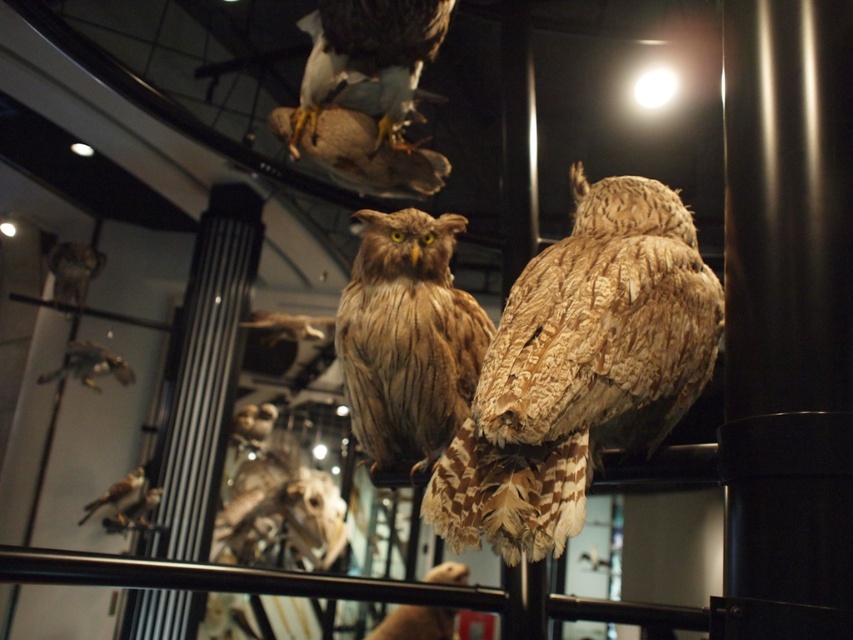
You are a museum visitor looking at the display of taxidermied birds. You see the brown feathered owl at upper center and the brown speckled feathers at lower left. Which object is positioned higher in the display?

The brown feathered owl at upper center is positioned higher than the brown speckled feathers at lower left.

You are a museum curator checking the display. You need to determine if the brown textured owl at center can be placed on a shelf that can only hold items up to the size of the brown feathered owl at upper center. Can it fit?

The brown textured owl at center is smaller than the brown feathered owl at upper center, so it can fit on the shelf designed for the latter.

You are a museum visitor observing the mounted birds. You notice two items at the center of the display. One is labeled as brown textured feathers at center and the other as brown textured owl at center. Which of these two items is located to the right of the other?

The brown textured feathers at center is positioned on the right side of brown textured owl at center, so the feathers are to the right of the owl.